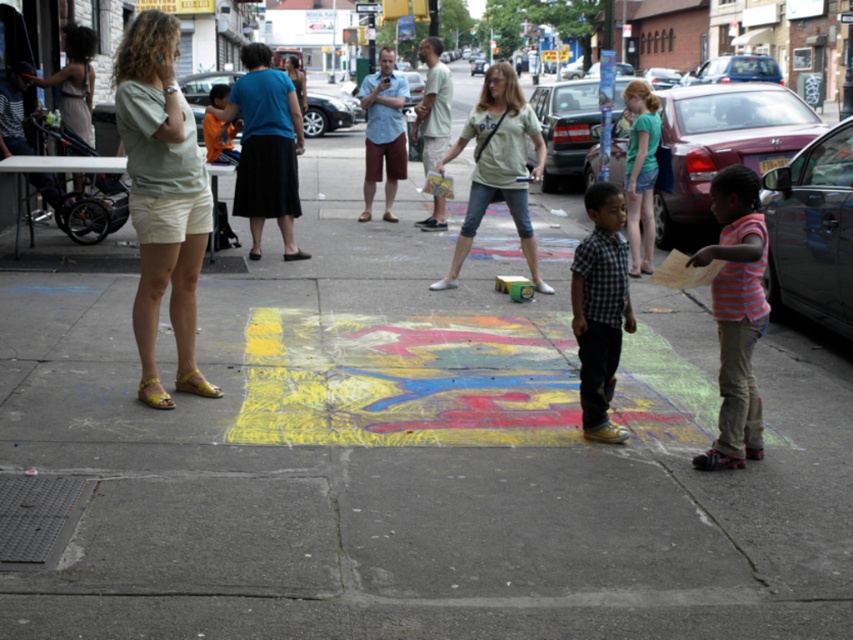
Who is lower down, light green cotton shirt at left or striped cotton shirt at lower right?

Positioned lower is striped cotton shirt at lower right.

Can you confirm if light green cotton shirt at left is positioned above striped cotton shirt at lower right?

Correct, light green cotton shirt at left is located above striped cotton shirt at lower right.

Does point (148, 72) lie in front of point (727, 460)?

No, it is behind (727, 460).

The width and height of the screenshot is (853, 640). In order to click on light green cotton shirt at left in this screenshot , I will do `click(161, 196)`.

Does light green t-shirt at center have a greater height compared to matte blue shirt at center?

No, light green t-shirt at center is not taller than matte blue shirt at center.

Measure the distance between point [457,234] and camera.

The distance of point [457,234] from camera is 11.04 meters.

Locate an element on the screen. Image resolution: width=853 pixels, height=640 pixels. light green t-shirt at center is located at coordinates (497, 164).

Which is below, light green cotton shirt at left or matte blue shirt at center?

Positioned lower is light green cotton shirt at left.

Between light green cotton shirt at left and matte blue shirt at center, which one appears on the left side from the viewer's perspective?

matte blue shirt at center is more to the left.

Who is more forward, (134,163) or (302,81)?

Point (134,163)

The height and width of the screenshot is (640, 853). Find the location of `light green cotton shirt at left`. light green cotton shirt at left is located at coordinates (161, 196).